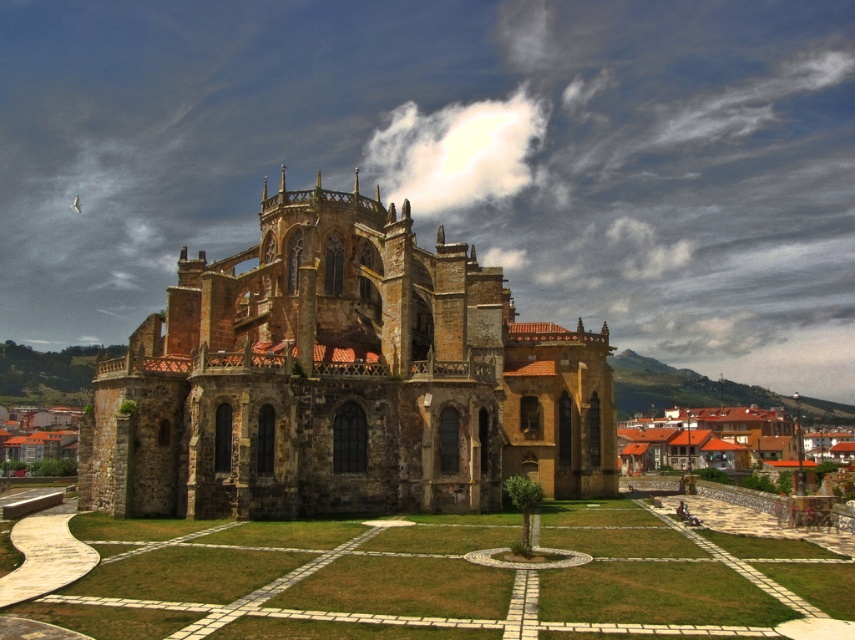
Is point (296, 353) farther from camera compared to point (789, 426)?

No, (296, 353) is closer to viewer.

Is brown stone church at center closer to the viewer compared to brown wooden houses at lower right?

Yes, it is.

Is point (517, 426) in front of point (747, 442)?

Yes, it is in front of point (747, 442).

The width and height of the screenshot is (855, 640). I want to click on brown stone church at center, so click(343, 380).

Between point (718, 424) and point (43, 448), which one is positioned in front?

Point (43, 448) is more forward.

Is point (782, 416) positioned behind point (42, 412)?

Yes, point (782, 416) is behind point (42, 412).

You are a GUI agent. You are given a task and a screenshot of the screen. Output one action in this format:
    pyautogui.click(x=<x>, y=<y>)
    Task: Click on the brown wooden houses at lower right
    
    Given the screenshot: What is the action you would take?
    pyautogui.click(x=714, y=436)

From the picture: Is brown stone church at center positioned at the back of brown stone buildings at lower left?

No.

Is the position of brown stone church at center less distant than that of brown stone buildings at lower left?

Yes, it is.

From the picture: Who is more forward, (556, 339) or (12, 444)?

Point (556, 339) is in front.

The height and width of the screenshot is (640, 855). Identify the location of brown stone church at center. (343, 380).